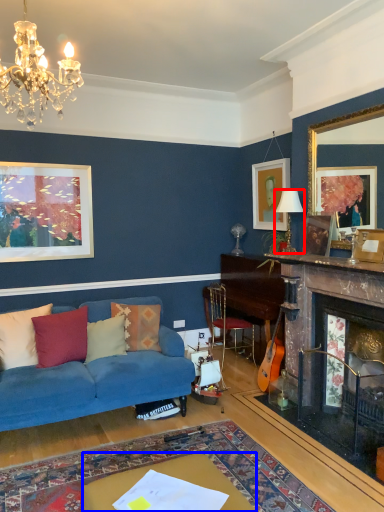
Question: Which object is closer to the camera taking this photo, lamp (highlighted by a red box) or table (highlighted by a blue box)?

Choices:
 (A) lamp
 (B) table

Answer: (B)